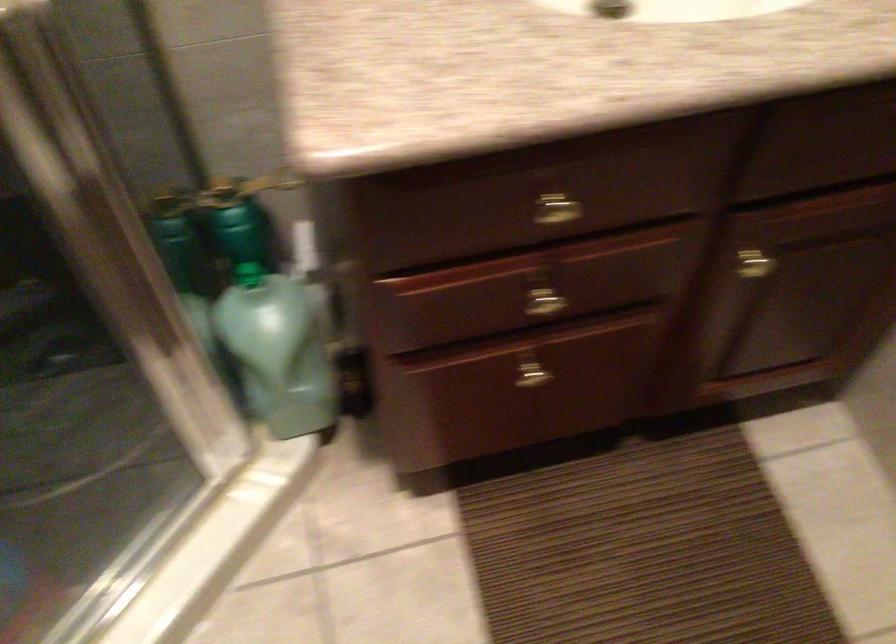
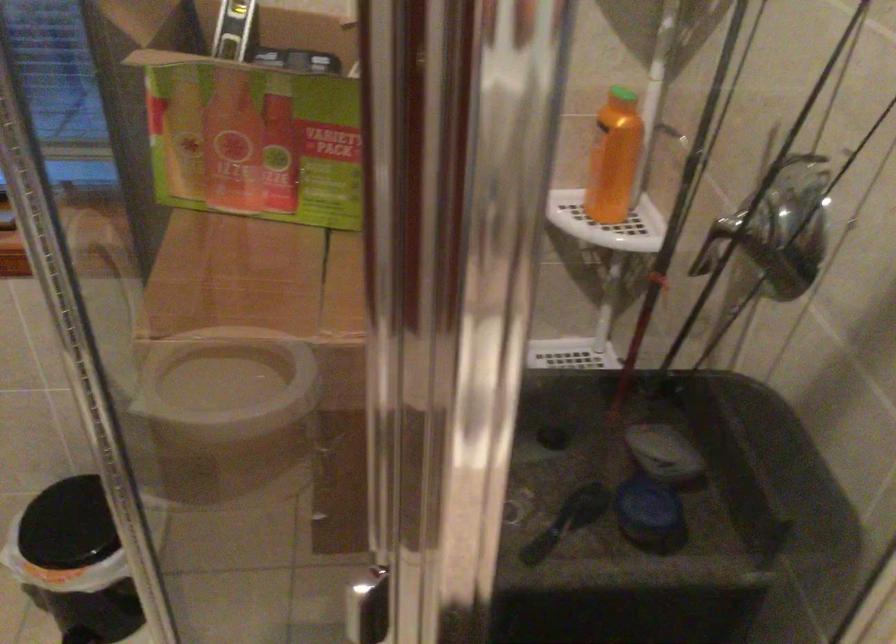
The images are taken continuously from a first-person perspective. In which direction is your viewpoint rotating?

The camera rotated toward left-down.